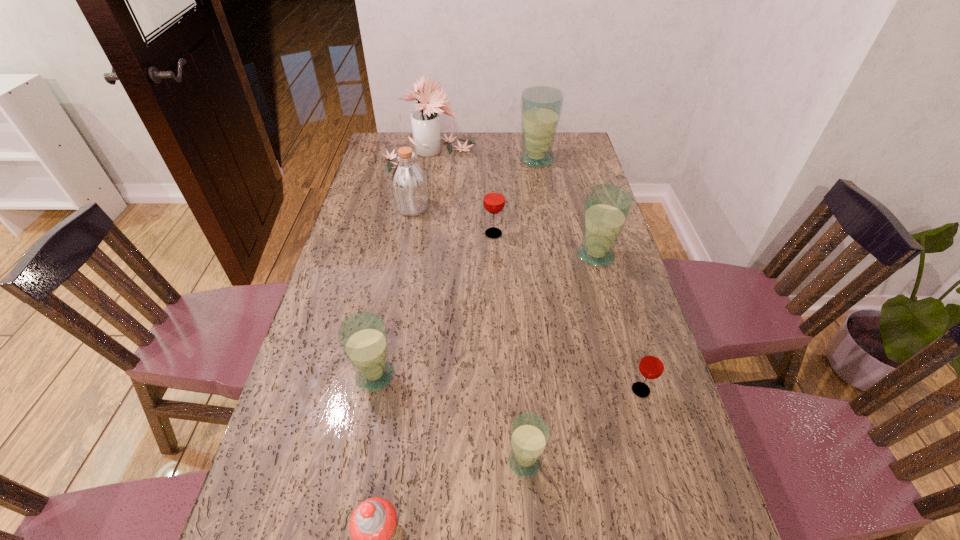
Where is `white bouquet`? The height and width of the screenshot is (540, 960). white bouquet is located at coordinates (425, 122).

In order to click on the tallest glass in this screenshot , I will do `click(541, 106)`.

Locate an element on the screen. The width and height of the screenshot is (960, 540). the farthest blue glass is located at coordinates (541, 106).

You are a GUI agent. You are given a task and a screenshot of the screen. Output one action in this format:
    pyautogui.click(x=<x>, y=<y>)
    Task: Click on the fifth shortest glass
    This screenshot has width=960, height=540.
    Given the screenshot: What is the action you would take?
    pyautogui.click(x=607, y=207)

Find the location of a particular element. Image resolution: width=960 pixels, height=540 pixels. the second biggest blue glass is located at coordinates (607, 207).

Where is `the third farthest object`? The height and width of the screenshot is (540, 960). the third farthest object is located at coordinates (409, 185).

At what (x,y) coordinates should I click in order to perform the action: click on the sixth nearest object. Please return your answer as a coordinate pair (x, y). Looking at the image, I should click on (494, 199).

This screenshot has width=960, height=540. Find the location of `the farther red glass`. the farther red glass is located at coordinates (494, 199).

You are a GUI agent. You are given a task and a screenshot of the screen. Output one action in this format:
    pyautogui.click(x=<x>, y=<y>)
    Task: Click on the leftmost blue glass
    This screenshot has height=540, width=960.
    Given the screenshot: What is the action you would take?
    pyautogui.click(x=363, y=337)

I want to click on the second smallest blue glass, so click(x=363, y=337).